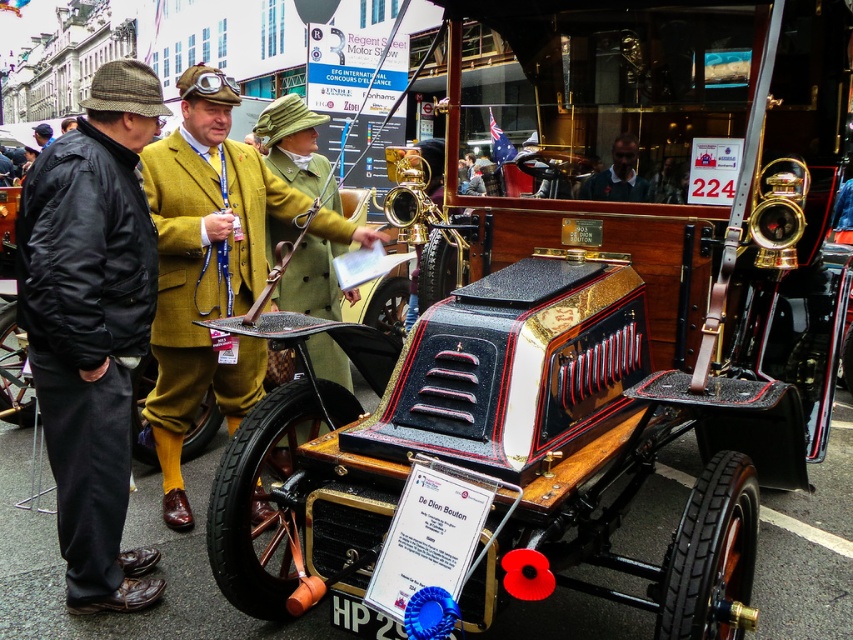
Measure the distance between wooden coach at left and brown leather hat at upper left.

48.78 feet

Is wooden coach at left above brown leather hat at upper left?

No.

Does point (126, 552) come behind point (36, 136)?

No, it is not.

At what (x,y) coordinates should I click in order to perform the action: click on wooden coach at left. Please return your answer as a coordinate pair (x, y). Looking at the image, I should click on (91, 324).

Does wooden coach at left appear on the right side of mustard wool suit at center?

No, wooden coach at left is not to the right of mustard wool suit at center.

Who is positioned more to the right, wooden coach at left or mustard wool suit at center?

From the viewer's perspective, mustard wool suit at center appears more on the right side.

You are a GUI agent. You are given a task and a screenshot of the screen. Output one action in this format:
    pyautogui.click(x=<x>, y=<y>)
    Task: Click on the wooden coach at left
    The height and width of the screenshot is (640, 853).
    Given the screenshot: What is the action you would take?
    pyautogui.click(x=91, y=324)

Is point (97, 525) closer to camera compared to point (602, 196)?

Yes, point (97, 525) is closer to viewer.

Is wooden coach at left in front of dark blue sweater at center?

Yes, wooden coach at left is closer to the viewer.

Who is more forward, (80, 556) or (604, 182)?

Point (80, 556) is in front.

What are the coordinates of `wooden coach at left` in the screenshot? It's located at (91, 324).